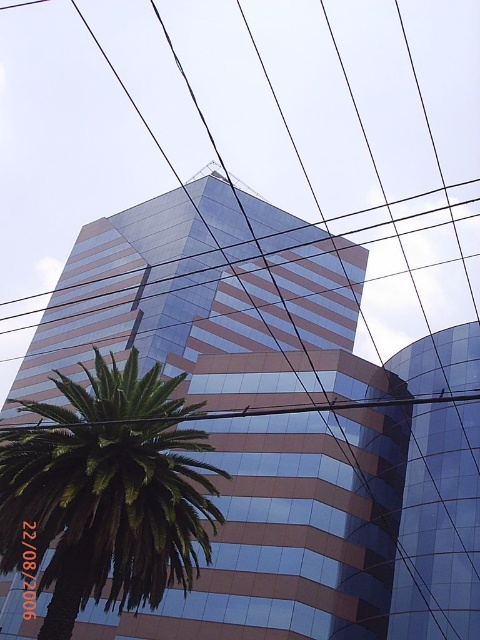
You are standing in front of the glassy reflective building at center and the green leafy palm at lower left. If you look up, which object would appear larger in your field of view?

The glassy reflective building at center appears larger in your field of view because it is much taller than the green leafy palm at lower left.

You are standing in front of the glassy reflective building at center. If you want to take a photo of it without including any power lines in the frame, how far back should you step?

The glassy reflective building at center is 9.85 meters away from the camera. To avoid including the power lines in the frame, you should step back to a distance greater than 9.85 meters.